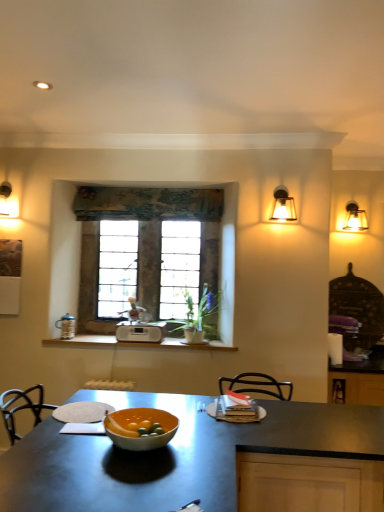
Image resolution: width=384 pixels, height=512 pixels. What do you see at coordinates (140, 332) in the screenshot?
I see `white plastic radio at center` at bounding box center [140, 332].

Describe the element at coordinates (355, 218) in the screenshot. Image resolution: width=384 pixels, height=512 pixels. I see `matte glass sconce at upper right` at that location.

In order to face matte glass sconce at upper right, should I rotate leftwards or rightwards?

Rotate right and turn 20.898 degrees.

What do you see at coordinates (283, 206) in the screenshot? I see `matte glass sconce at upper right` at bounding box center [283, 206].

At what (x,y) coordinates should I click in order to perform the action: click on white wood counter at center. Please return your answer as a coordinate pair (x, y). This screenshot has height=512, width=384. Looking at the image, I should click on (137, 343).

You are a GUI agent. You are given a task and a screenshot of the screen. Output one action in this format:
    pyautogui.click(x=<x>, y=<y>)
    Task: Click on the textured fabric curtain at center
    The width and height of the screenshot is (384, 512).
    Given the screenshot: What is the action you would take?
    pos(147,203)

Is matte glass sconce at upper right inside or outside of white wood counter at center?

matte glass sconce at upper right cannot be found inside white wood counter at center.

Can you tell me how much matte glass sconce at upper right and white wood counter at center differ in facing direction?

0.876 degrees separate the facing orientations of matte glass sconce at upper right and white wood counter at center.

Is matte glass sconce at upper right oriented towards white wood counter at center?

No, matte glass sconce at upper right is not oriented towards white wood counter at center.

From the image's perspective, is matte glass sconce at upper right above white wood counter at center?

Yes, from the image's perspective, matte glass sconce at upper right is over white wood counter at center.

From the picture: Can glossy black countertop at center be found inside white wood counter at center?

No.

In terms of size, does white wood counter at center appear bigger or smaller than glossy black countertop at center?

white wood counter at center is smaller than glossy black countertop at center.

Can you confirm if white wood counter at center is shorter than glossy black countertop at center?

Indeed, white wood counter at center has a lesser height compared to glossy black countertop at center.

Could you tell me if white wood counter at center is turned towards glossy black countertop at center?

No, white wood counter at center is not turned towards glossy black countertop at center.

Does point (355, 224) appear closer or farther from the camera than point (173, 347)?

Point (355, 224).

Measure the distance from matte glass sconce at upper right to white wood counter at center.

matte glass sconce at upper right is 6.27 feet from white wood counter at center.

This screenshot has width=384, height=512. Find the location of `light fixture above the white wood counter at center (from the image's perspective)`. light fixture above the white wood counter at center (from the image's perspective) is located at coordinates (355, 218).

From their relative heights in the image, would you say matte glass sconce at upper right is taller or shorter than white wood counter at center?

Clearly, matte glass sconce at upper right is taller compared to white wood counter at center.

Is textured fabric curtain at center turned away from matte glass sconce at upper right?

No, textured fabric curtain at center's orientation is not away from matte glass sconce at upper right.

The height and width of the screenshot is (512, 384). I want to click on lamp below the textured fabric curtain at center (from a real-world perspective), so click(x=283, y=206).

From the image's perspective, is textured fabric curtain at center on matte glass sconce at upper right?

Yes, from the image's perspective, textured fabric curtain at center is over matte glass sconce at upper right.

Is matte orange bowl at center turned away from white plastic radio at center?

No, matte orange bowl at center is not facing the opposite direction of white plastic radio at center.

Based on the photo, considering the sizes of objects matte orange bowl at center and white plastic radio at center in the image provided, who is smaller, matte orange bowl at center or white plastic radio at center?

matte orange bowl at center.

In the image, is matte orange bowl at center positioned in front of or behind white plastic radio at center?

matte orange bowl at center is positioned closer to the viewer than white plastic radio at center.

Which object is further away from the camera taking this photo, stone textured window at center or glossy black countertop at center?

stone textured window at center.

Who is taller, stone textured window at center or glossy black countertop at center?

stone textured window at center is taller.

From the image's perspective, which is below, stone textured window at center or glossy black countertop at center?

glossy black countertop at center is shown below in the image.

Does matte glass sconce at upper right have a smaller size compared to stone textured window at center?

Correct, matte glass sconce at upper right occupies less space than stone textured window at center.

Which is farther from the camera, (287, 218) or (188, 269)?

Point (188, 269)

Between matte glass sconce at upper right and stone textured window at center, which one has smaller width?

stone textured window at center.

I want to click on lamp on the right of white wood counter at center, so click(283, 206).

Locate an element on the screen. Image resolution: width=384 pixels, height=512 pixels. countertop that is below the white wood counter at center (from the image's perspective) is located at coordinates (203, 461).

Which object lies nearer to the anchor point stone textured window at center, white plastic radio at center or textured fabric curtain at center?

textured fabric curtain at center is positioned closer to the anchor stone textured window at center.

Looking at this image, considering their positions, is white plastic radio at center positioned closer to matte glass sconce at upper right than stone textured window at center?

Among the two, stone textured window at center is located nearer to matte glass sconce at upper right.

Based on their spatial positions, is stone textured window at center or white wood counter at center closer to matte orange bowl at center?

Among the two, white wood counter at center is located nearer to matte orange bowl at center.

From the image, which object appears to be nearer to matte orange bowl at center, glossy black countertop at center or matte glass sconce at upper right?

glossy black countertop at center is positioned closer to the anchor matte orange bowl at center.

When comparing their distances from matte orange bowl at center, does matte glass sconce at upper right or stone textured window at center seem further?

matte glass sconce at upper right lies further to matte orange bowl at center than the other object.

From the image, which object appears to be farther from white wood counter at center, matte glass sconce at upper right or matte orange bowl at center?

matte glass sconce at upper right is positioned further to the anchor white wood counter at center.

Looking at the image, which one is located closer to matte glass sconce at upper right, glossy black countertop at center or white wood counter at center?

white wood counter at center.

Considering their positions, is white wood counter at center positioned further to textured fabric curtain at center than stone textured window at center?

Among the two, white wood counter at center is located further to textured fabric curtain at center.

Locate an element on the screen. The width and height of the screenshot is (384, 512). bowl between glossy black countertop at center and white wood counter at center from front to back is located at coordinates (140, 420).

You are a GUI agent. You are given a task and a screenshot of the screen. Output one action in this format:
    pyautogui.click(x=<x>, y=<y>)
    Task: Click on the lamp located between matte orange bowl at center and textured fabric curtain at center in the depth direction
    
    Given the screenshot: What is the action you would take?
    pyautogui.click(x=283, y=206)

Locate an element on the screen. The height and width of the screenshot is (512, 384). counter located between glossy black countertop at center and white plastic radio at center in the depth direction is located at coordinates (137, 343).

I want to click on window located between white plastic radio at center and matte glass sconce at upper right in the left-right direction, so click(161, 241).